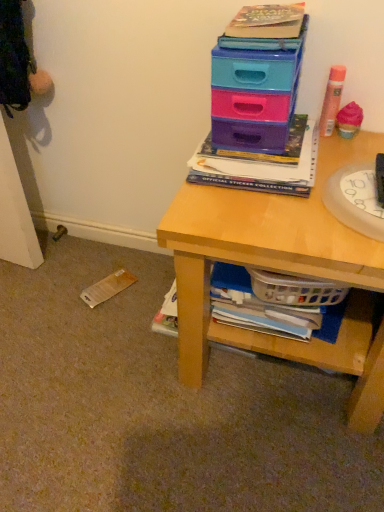
The height and width of the screenshot is (512, 384). Identify the location of free space between pink matte hair spray at upper right and transparent plastic plate at right. (341, 156).